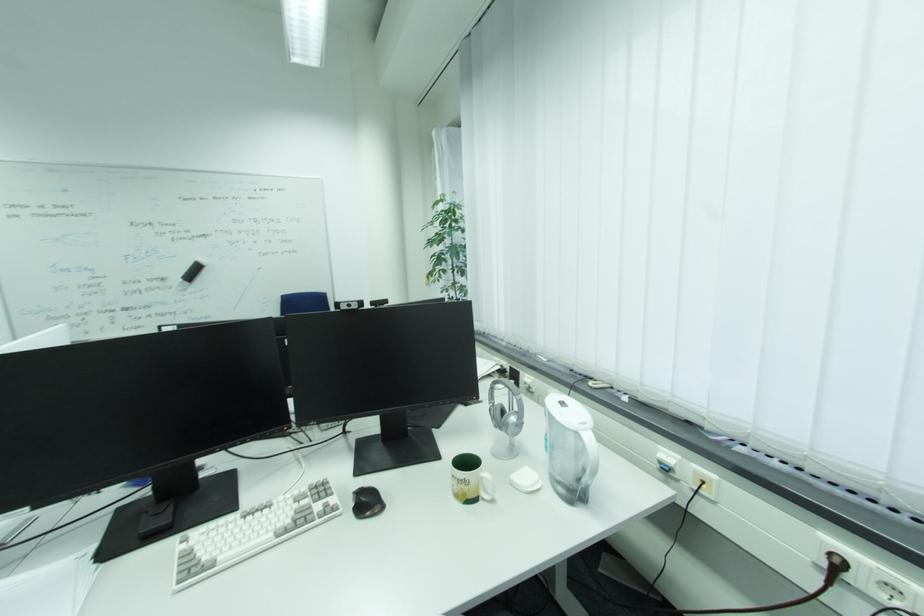
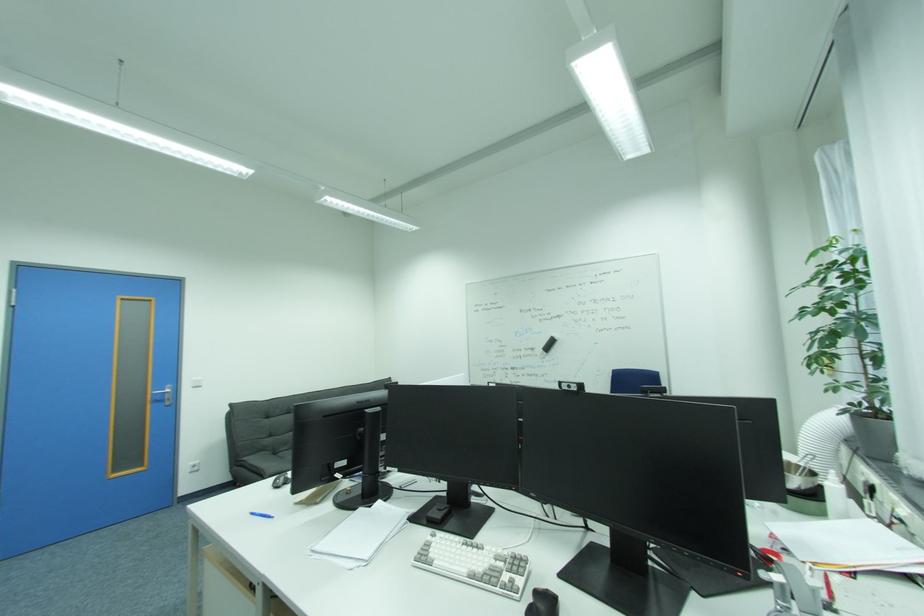
Question: Based on the continuous images, in which direction is the camera rotating? Reply with the corresponding letter.

Choices:
 (A) Left
 (B) Right
 (C) Up
 (D) Down

Answer: (A)